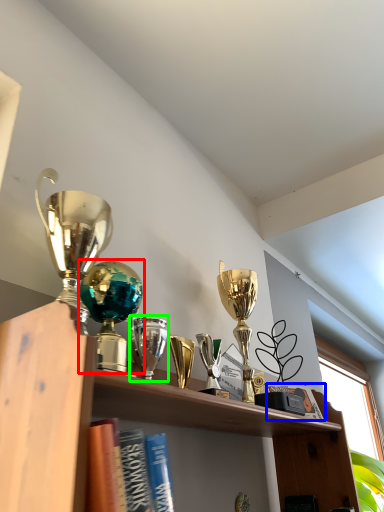
Question: Which is farther away from trophy (highlighted by a red box)? book (highlighted by a blue box) or trophy (highlighted by a green box)?

Choices:
 (A) book
 (B) trophy

Answer: (A)